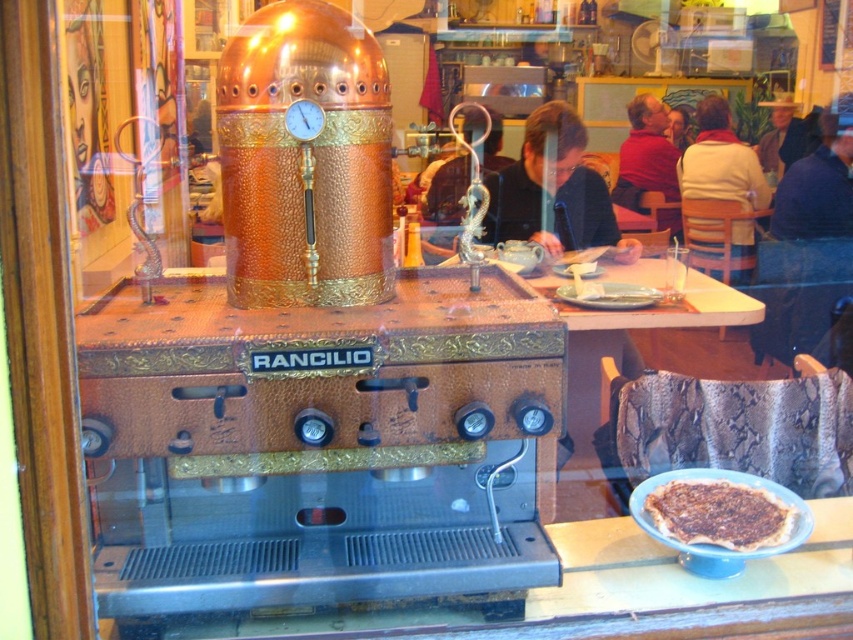
Question: Considering the relative positions of silver metallic dragon at center and dark brown leather jacket at upper right in the image provided, where is silver metallic dragon at center located with respect to dark brown leather jacket at upper right?

Choices:
 (A) below
 (B) above

Answer: (A)

Question: Estimate the real-world distances between objects in this image. Which object is closer to the red sweater at upper right?

Choices:
 (A) silver metallic dragon at center
 (B) dark brown leather jacket at upper right
 (C) light brown wooden chair at upper right
 (D) dark brown crusty pizza at lower right

Answer: (C)

Question: Considering the relative positions of blue fabric jacket at upper right and silver metallic dragon at center in the image provided, where is blue fabric jacket at upper right located with respect to silver metallic dragon at center?

Choices:
 (A) below
 (B) above

Answer: (B)

Question: Based on their relative distances, which object is farther from the blue fabric jacket at upper right?

Choices:
 (A) dark brown leather jacket at upper right
 (B) silver metallic dragon at center
 (C) dark brown crusty pizza at lower right
 (D) light brown wooden chair at upper right

Answer: (C)

Question: Can you confirm if red sweater at upper right is positioned above silver metallic dragon at center?

Choices:
 (A) no
 (B) yes

Answer: (B)

Question: Which object is positioned closest to the blue fabric jacket at upper right?

Choices:
 (A) light brown wooden chair at upper right
 (B) dark brown leather jacket at upper right

Answer: (B)